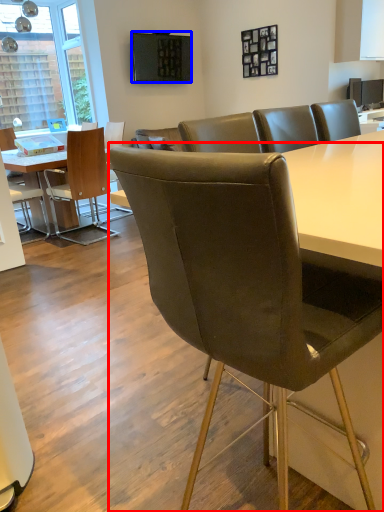
Question: Among these objects, which one is nearest to the camera, chair (highlighted by a red box) or television (highlighted by a blue box)?

Choices:
 (A) chair
 (B) television

Answer: (A)